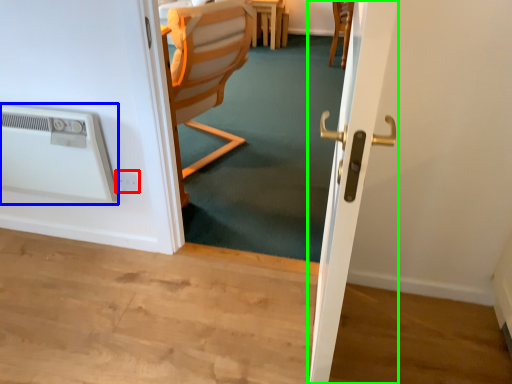
Question: Which object is positioned farthest from electric outlet (highlighted by a red box)? Select from air conditioning (highlighted by a blue box) and screen door (highlighted by a green box).

Choices:
 (A) air conditioning
 (B) screen door

Answer: (B)